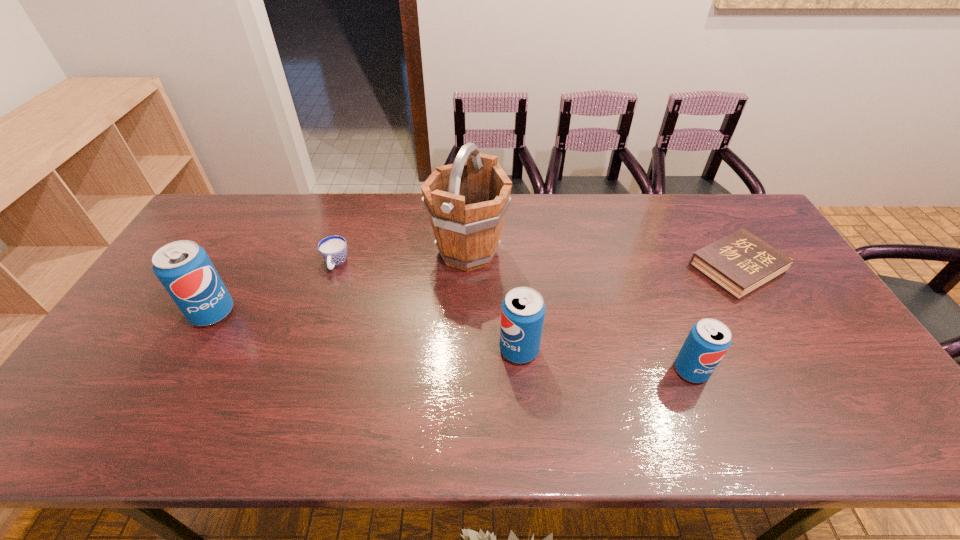
Where is `the farthest soda can`? the farthest soda can is located at coordinates (183, 267).

Where is `the leftmost object`? the leftmost object is located at coordinates (183, 267).

You are a GUI agent. You are given a task and a screenshot of the screen. Output one action in this format:
    pyautogui.click(x=<x>, y=<y>)
    Task: Click on the third tallest object
    The width and height of the screenshot is (960, 540).
    Given the screenshot: What is the action you would take?
    pyautogui.click(x=522, y=311)

You are a GUI agent. You are given a task and a screenshot of the screen. Output one action in this format:
    pyautogui.click(x=<x>, y=<y>)
    Task: Click on the second shortest soda can
    
    Given the screenshot: What is the action you would take?
    pyautogui.click(x=522, y=311)

Identify the location of the shortest soda can. (709, 339).

Locate an element on the screen. the third shortest object is located at coordinates (709, 339).

Where is `the fifth tallest object`? This screenshot has width=960, height=540. the fifth tallest object is located at coordinates (333, 249).

Image resolution: width=960 pixels, height=540 pixels. Find the location of `the fifth object from right to left`. the fifth object from right to left is located at coordinates (333, 249).

This screenshot has height=540, width=960. In order to click on bucket in this screenshot , I will do `click(466, 203)`.

Where is `the shortest object`? The image size is (960, 540). the shortest object is located at coordinates (739, 263).